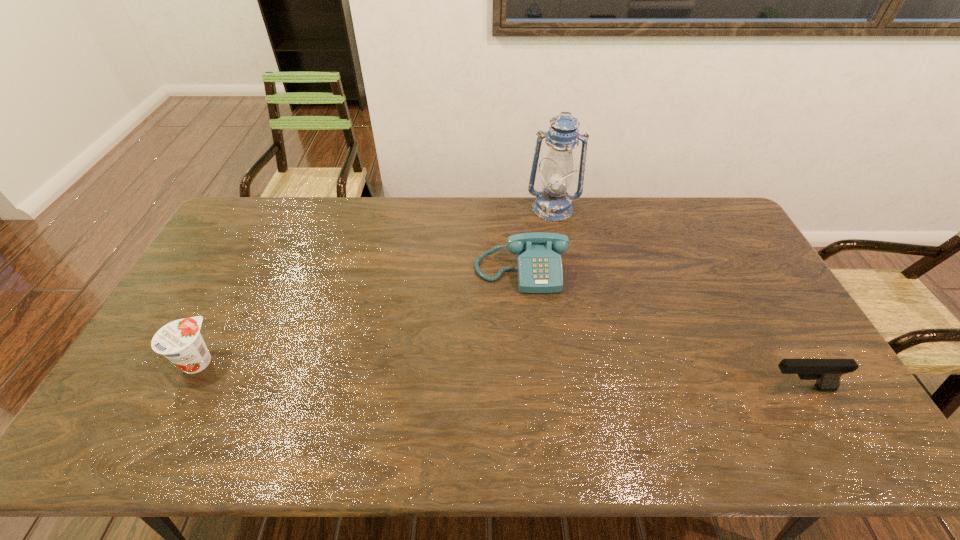
This screenshot has height=540, width=960. I want to click on vacant position in the image that satisfies the following two spatial constraints: 1. on the back side of the telephone; 2. on the left side of the tallest object, so click(516, 208).

Where is `free space that satisfies the following two spatial constraints: 1. on the front side of the second nearest object; 2. on the front-facing side of the pistol`? free space that satisfies the following two spatial constraints: 1. on the front side of the second nearest object; 2. on the front-facing side of the pistol is located at coordinates (183, 388).

Where is `vacant position in the image that satisfies the following two spatial constraints: 1. on the front side of the pistol; 2. on the front-facing side of the telephone`? vacant position in the image that satisfies the following two spatial constraints: 1. on the front side of the pistol; 2. on the front-facing side of the telephone is located at coordinates (531, 388).

This screenshot has height=540, width=960. Find the location of `vacant space that satisfies the following two spatial constraints: 1. on the front side of the second nearest object; 2. on the front-facing side of the pistol`. vacant space that satisfies the following two spatial constraints: 1. on the front side of the second nearest object; 2. on the front-facing side of the pistol is located at coordinates (183, 388).